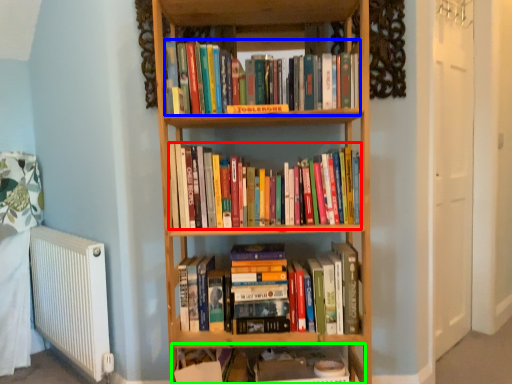
Question: Estimate the real-world distances between objects in this image. Which object is closer to book (highlighted by a red box), book (highlighted by a blue box) or shelf (highlighted by a green box)?

Choices:
 (A) book
 (B) shelf

Answer: (A)